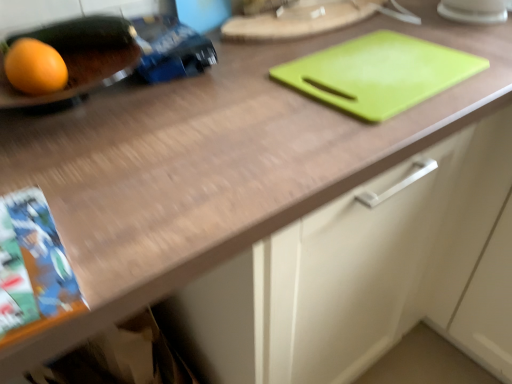
You are a GUI agent. You are given a task and a screenshot of the screen. Output one action in this format:
    pyautogui.click(x=<x>, y=<y>)
    Task: Click on the free spot to the right of orange matte grapefruit at left
    The height and width of the screenshot is (384, 512).
    Given the screenshot: What is the action you would take?
    click(x=148, y=104)